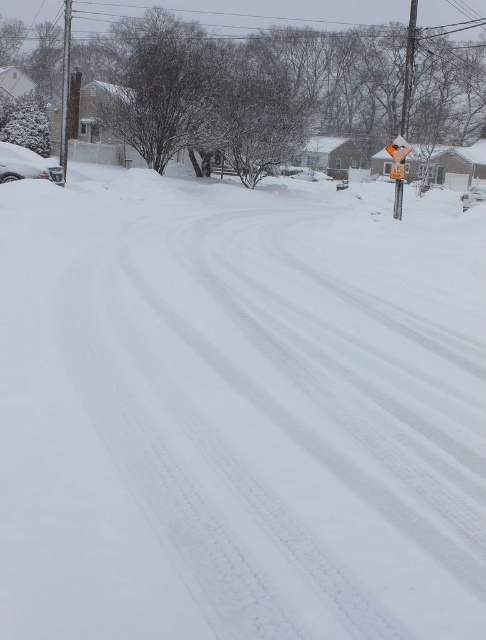
From the picture: Does yellow plastic diamond-shaped sign at upper right lie in front of white matte car at center?

Yes, it is.

Is yellow plastic diamond-shaped sign at upper right shorter than white matte car at center?

Yes, yellow plastic diamond-shaped sign at upper right is shorter than white matte car at center.

Is point (397, 145) behind point (469, 193)?

No, (397, 145) is closer to viewer.

The height and width of the screenshot is (640, 486). Identify the location of yellow plastic diamond-shaped sign at upper right. pyautogui.click(x=398, y=170).